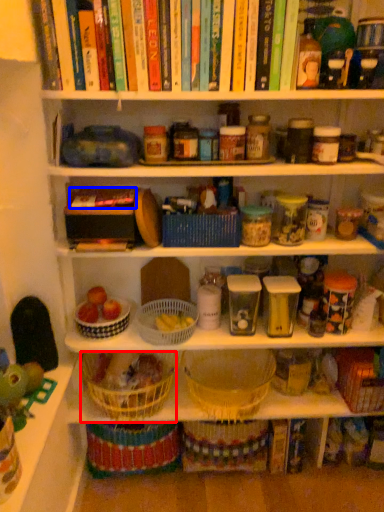
Question: Which object is further to the camera taking this photo, basket (highlighted by a red box) or book (highlighted by a blue box)?

Choices:
 (A) basket
 (B) book

Answer: (A)